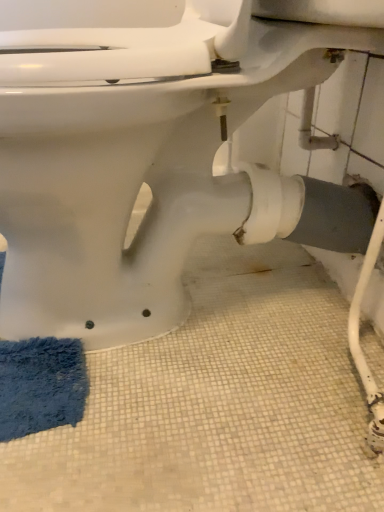
Where is `blank space situated above blue fuzzy bath mat at lower left (from a real-world perspective)`? blank space situated above blue fuzzy bath mat at lower left (from a real-world perspective) is located at coordinates (34, 356).